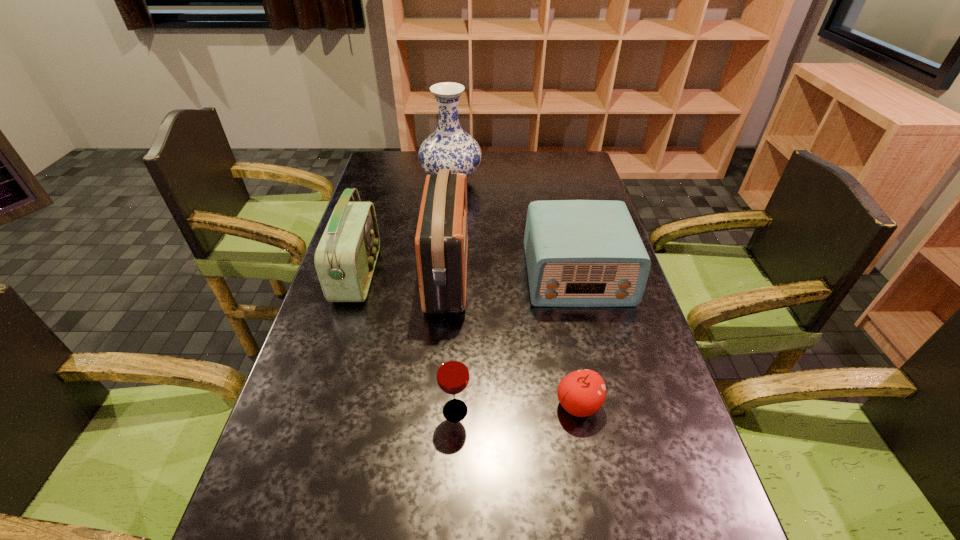
Image resolution: width=960 pixels, height=540 pixels. Find the location of `vase`. vase is located at coordinates (449, 147).

Where is `the second radio receiver from left to right`? the second radio receiver from left to right is located at coordinates (441, 243).

This screenshot has height=540, width=960. Find the location of `the fifth shortest object`. the fifth shortest object is located at coordinates (441, 243).

The image size is (960, 540). In order to click on the third tallest object in this screenshot , I will do `click(345, 258)`.

Where is `the second tallest radio receiver`? The width and height of the screenshot is (960, 540). the second tallest radio receiver is located at coordinates (345, 258).

Where is `the shortest radio receiver`? The width and height of the screenshot is (960, 540). the shortest radio receiver is located at coordinates (579, 253).

Locate an element on the screen. The image size is (960, 540). glass is located at coordinates (452, 373).

Identify the location of apple. (581, 393).

The height and width of the screenshot is (540, 960). In order to click on vacant region located 0.260m on the front of the farthest object in this screenshot , I will do `click(445, 240)`.

At what (x,y) coordinates should I click in order to perform the action: click on free space located 0.180m on the front-facing side of the tallest radio receiver. Please return your answer as a coordinate pair (x, y). The width and height of the screenshot is (960, 540). Looking at the image, I should click on (530, 275).